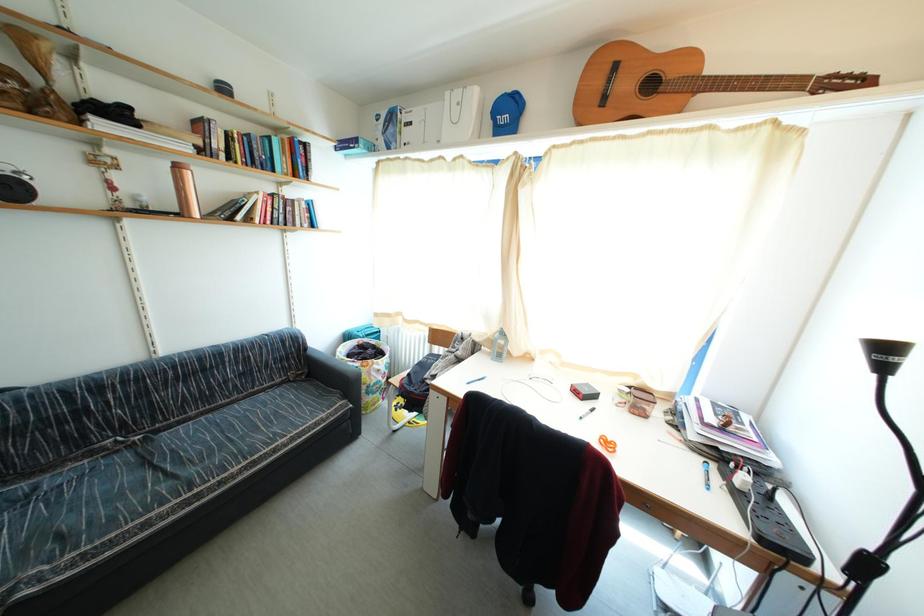
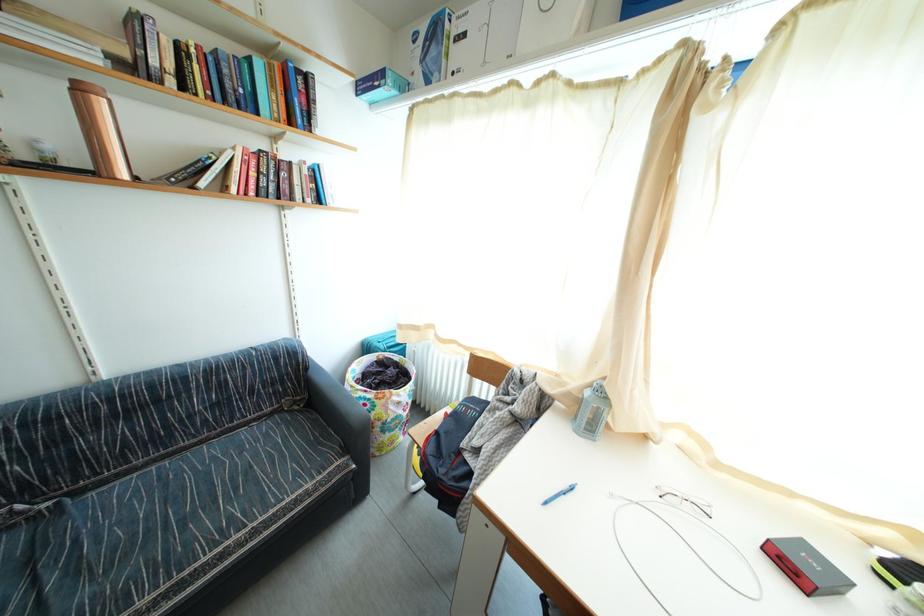
Question: The camera is either moving clockwise (left) or counter-clockwise (right) around the object. The first image is from the beginning of the video and the second image is from the end. Is the camera moving left or right when shooting the video?

Choices:
 (A) Left
 (B) Right

Answer: (B)